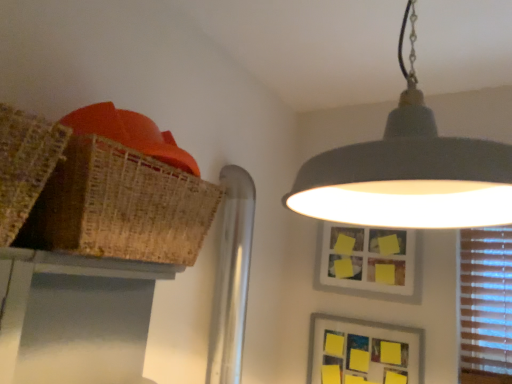
Question: Is bamboo table at upper left far from matte gray lampshade at upper center?

Choices:
 (A) yes
 (B) no

Answer: (B)

Question: Is bamboo table at upper left smaller than matte gray lampshade at upper center?

Choices:
 (A) no
 (B) yes

Answer: (B)

Question: Is bamboo table at upper left positioned with its back to matte gray lampshade at upper center?

Choices:
 (A) yes
 (B) no

Answer: (B)

Question: Considering the relative positions of bamboo table at upper left and matte gray lampshade at upper center in the image provided, is bamboo table at upper left in front of matte gray lampshade at upper center?

Choices:
 (A) yes
 (B) no

Answer: (B)

Question: Does bamboo table at upper left have a greater width compared to matte gray lampshade at upper center?

Choices:
 (A) no
 (B) yes

Answer: (A)

Question: Considering the positions of yellow matte picture frame at upper center, the 1th picture frame from the top, and bamboo table at upper left in the image, is yellow matte picture frame at upper center, the 1th picture frame from the top, taller or shorter than bamboo table at upper left?

Choices:
 (A) tall
 (B) short

Answer: (A)

Question: Is yellow matte picture frame at upper center, marked as the 2th picture frame in a bottom-to-top arrangement, wider or thinner than bamboo table at upper left?

Choices:
 (A) wide
 (B) thin

Answer: (B)

Question: Is yellow matte picture frame at upper center, the 1th picture frame from the top, situated inside bamboo table at upper left or outside?

Choices:
 (A) outside
 (B) inside

Answer: (A)

Question: Would you say yellow matte picture frame at upper center, marked as the 2th picture frame in a bottom-to-top arrangement, is to the left or to the right of bamboo table at upper left in the picture?

Choices:
 (A) right
 (B) left

Answer: (A)

Question: Is bamboo table at upper left taller or shorter than yellow matte picture frame at upper center, the 1th picture frame from the top?

Choices:
 (A) tall
 (B) short

Answer: (B)

Question: Considering the relative positions of bamboo table at upper left and yellow matte picture frame at upper center, marked as the 2th picture frame in a bottom-to-top arrangement, in the image provided, is bamboo table at upper left to the left or to the right of yellow matte picture frame at upper center, marked as the 2th picture frame in a bottom-to-top arrangement,?

Choices:
 (A) left
 (B) right

Answer: (A)

Question: From a real-world perspective, is bamboo table at upper left positioned above or below yellow matte picture frame at upper center, marked as the 2th picture frame in a bottom-to-top arrangement?

Choices:
 (A) below
 (B) above

Answer: (A)

Question: Is bamboo table at upper left bigger or smaller than yellow matte picture frame at upper center, marked as the 2th picture frame in a bottom-to-top arrangement?

Choices:
 (A) small
 (B) big

Answer: (B)

Question: Considering the positions of bamboo table at upper left and yellow paper picture frame at lower right, which is counted as the second picture frame, starting from the top, in the image, is bamboo table at upper left wider or thinner than yellow paper picture frame at lower right, which is counted as the second picture frame, starting from the top,?

Choices:
 (A) wide
 (B) thin

Answer: (A)

Question: From a real-world perspective, is bamboo table at upper left positioned above or below yellow paper picture frame at lower right, the first picture frame when ordered from bottom to top?

Choices:
 (A) below
 (B) above

Answer: (B)